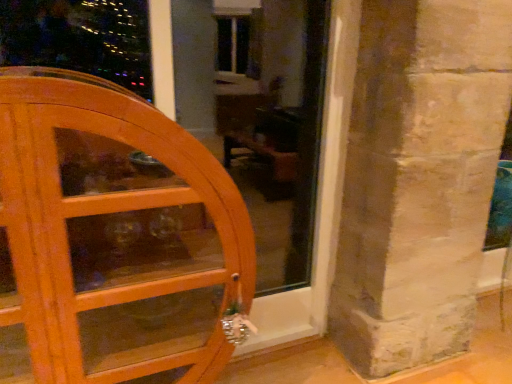
Describe the element at coordinates (106, 213) in the screenshot. The image size is (512, 384). I see `wooden cabinet at left` at that location.

Locate an element on the screen. The height and width of the screenshot is (384, 512). wooden cabinet at left is located at coordinates (106, 213).

What is the approximate width of wooden cabinet at left?

The width of wooden cabinet at left is 19.20 inches.

You are a GUI agent. You are given a task and a screenshot of the screen. Output one action in this format:
    pyautogui.click(x=<x>, y=<y>)
    Task: Click on the wooden cabinet at left
    The width and height of the screenshot is (512, 384).
    Given the screenshot: What is the action you would take?
    pyautogui.click(x=106, y=213)